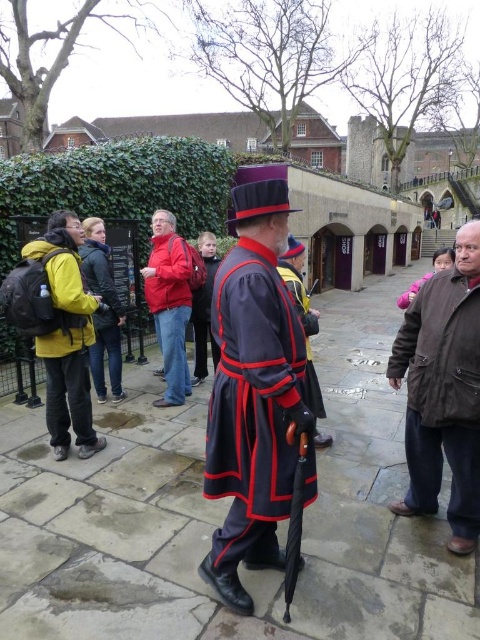
Question: Which point is farther from the camera taking this photo?

Choices:
 (A) (201, 364)
 (B) (180, 305)

Answer: (A)

Question: Can you confirm if dark gray woolen robe at center is positioned to the left of velvet-like dark gray robe at center?

Choices:
 (A) no
 (B) yes

Answer: (A)

Question: Which of the following is the closest to the observer?

Choices:
 (A) red fabric jacket at center
 (B) yellow matte jacket at left
 (C) velvet-like dark gray robe at center
 (D) brown wool coat at right

Answer: (D)

Question: Can you confirm if velvet-like dark blue robe at center is bigger than velvet-like dark gray robe at center?

Choices:
 (A) no
 (B) yes

Answer: (A)

Question: Does red fabric jacket at center appear on the left side of velvet-like dark blue robe at center?

Choices:
 (A) yes
 (B) no

Answer: (A)

Question: Which of these objects is positioned closest to the dark gray woolen robe at center?

Choices:
 (A) matte black robe at center
 (B) brown wool coat at right
 (C) red fabric jacket at center
 (D) velvet-like dark blue robe at center

Answer: (D)